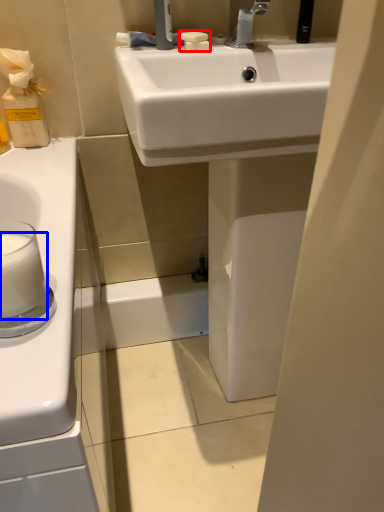
Question: Which object appears farthest to the camera in this image, soap (highlighted by a red box) or milk (highlighted by a blue box)?

Choices:
 (A) soap
 (B) milk

Answer: (A)